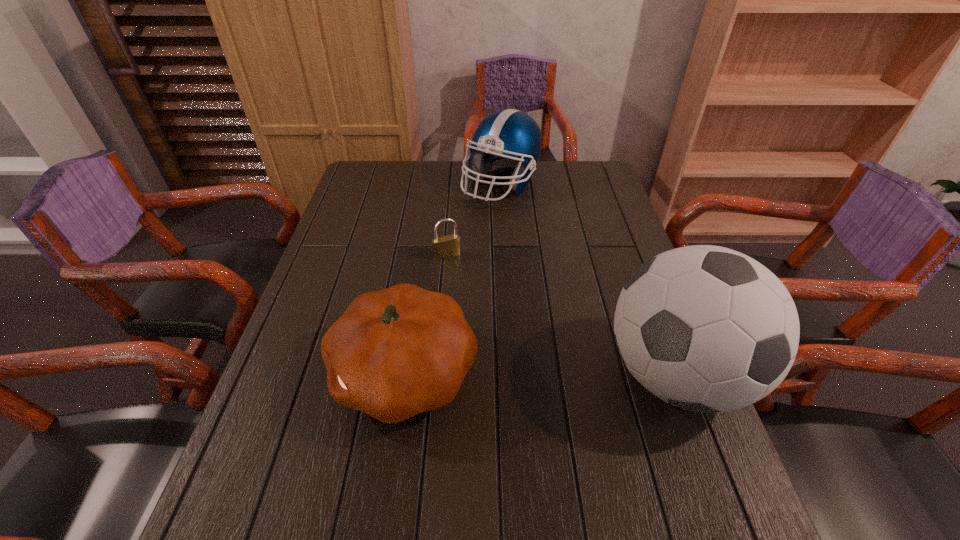
Locate an element on the screen. This screenshot has height=540, width=960. free spot on the desktop that is between the pumpkin and the soccer ball and is positioned on the front-facing side of the shortest object is located at coordinates (508, 374).

Find the location of `vacant spot on the desktop that is between the pumpkin and the soccer ball and is positioned at the front of the football helmet with the faceguard`. vacant spot on the desktop that is between the pumpkin and the soccer ball and is positioned at the front of the football helmet with the faceguard is located at coordinates (566, 374).